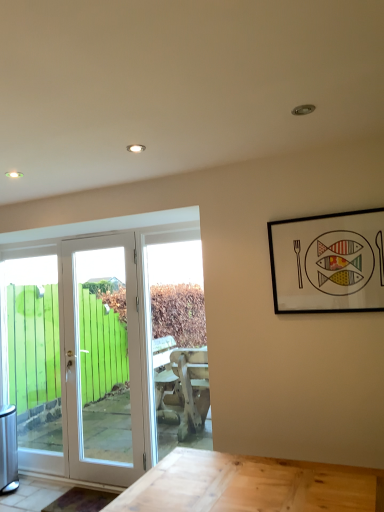
Question: Is transparent glass door at left oriented towards white glossy door at left, which appears as the first door when viewed from the right?

Choices:
 (A) no
 (B) yes

Answer: (A)

Question: Considering the relative sizes of transparent glass door at left and white glossy door at left, which appears as the first door when viewed from the right, in the image provided, is transparent glass door at left bigger than white glossy door at left, which appears as the first door when viewed from the right,?

Choices:
 (A) yes
 (B) no

Answer: (B)

Question: Is white glossy door at left, the second door in the left-to-right sequence, completely or partially inside transparent glass door at left?

Choices:
 (A) yes
 (B) no

Answer: (B)

Question: Is white glossy door at left, the second door in the left-to-right sequence, at the back of transparent glass door at left?

Choices:
 (A) no
 (B) yes

Answer: (A)

Question: Does transparent glass door at left have a lesser width compared to white glossy door at left, the second door in the left-to-right sequence?

Choices:
 (A) no
 (B) yes

Answer: (B)

Question: From a real-world perspective, is white glossy door at left, the 1th door when ordered from left to right, above or below transparent glass door at left?

Choices:
 (A) below
 (B) above

Answer: (A)

Question: From the image's perspective, relative to transparent glass door at left, is white glossy door at left, the 1th door when ordered from left to right, above or below?

Choices:
 (A) below
 (B) above

Answer: (A)

Question: Based on their positions, is white glossy door at left, positioned as the second door in right-to-left order, located to the left or right of transparent glass door at left?

Choices:
 (A) right
 (B) left

Answer: (A)

Question: Considering the positions of white glossy door at left, positioned as the second door in right-to-left order, and transparent glass door at left in the image, is white glossy door at left, positioned as the second door in right-to-left order, wider or thinner than transparent glass door at left?

Choices:
 (A) thin
 (B) wide

Answer: (A)

Question: Is white glossy door at left, the 1th door when ordered from left to right, inside or outside of white glossy door at left, which appears as the first door when viewed from the right?

Choices:
 (A) outside
 (B) inside

Answer: (B)

Question: From a real-world perspective, relative to white glossy door at left, the second door in the left-to-right sequence, is white glossy door at left, positioned as the second door in right-to-left order, vertically above or below?

Choices:
 (A) above
 (B) below

Answer: (B)

Question: In terms of size, does white glossy door at left, the 1th door when ordered from left to right, appear bigger or smaller than white glossy door at left, which appears as the first door when viewed from the right?

Choices:
 (A) big
 (B) small

Answer: (A)

Question: Based on their positions, is white glossy door at left, the 1th door when ordered from left to right, located to the left or right of white glossy door at left, which appears as the first door when viewed from the right?

Choices:
 (A) left
 (B) right

Answer: (A)

Question: Is white glossy door at left, the second door in the left-to-right sequence, to the left or to the right of black matte picture frame at upper right in the image?

Choices:
 (A) left
 (B) right

Answer: (A)

Question: From the image's perspective, is white glossy door at left, the second door in the left-to-right sequence, positioned above or below black matte picture frame at upper right?

Choices:
 (A) below
 (B) above

Answer: (A)